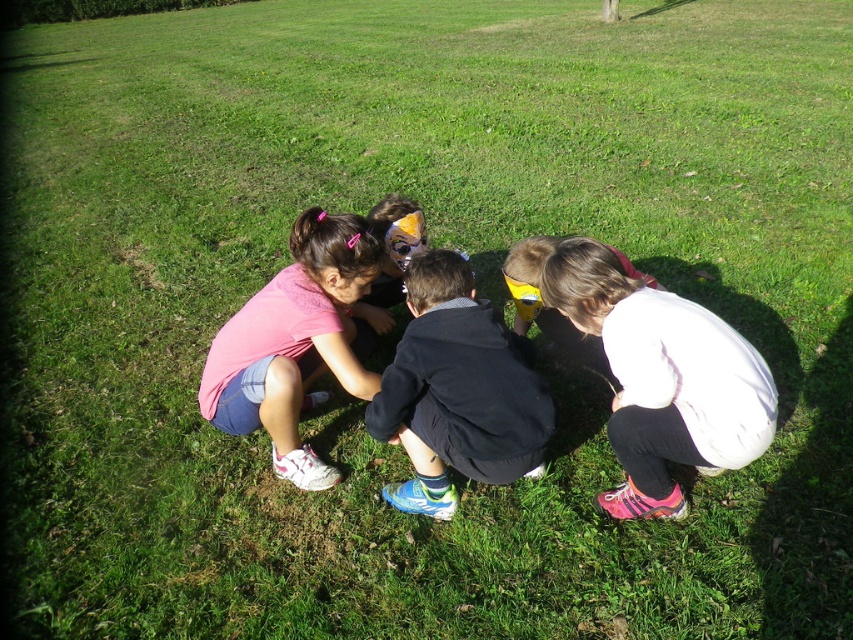
Can you confirm if white matte jacket at lower right is wider than black matte jacket at center?

Yes.

Looking at this image, between white matte jacket at lower right and black matte jacket at center, which one is positioned lower?

Positioned lower is black matte jacket at center.

At what (x,y) coordinates should I click in order to perform the action: click on white matte jacket at lower right. Please return your answer as a coordinate pair (x, y). Image resolution: width=853 pixels, height=640 pixels. Looking at the image, I should click on (662, 378).

Image resolution: width=853 pixels, height=640 pixels. I want to click on white matte jacket at lower right, so click(x=662, y=378).

Which of these two, white matte jacket at lower right or pink fabric shirt at center, stands shorter?

white matte jacket at lower right

Which of these two, white matte jacket at lower right or pink fabric shirt at center, stands taller?

Standing taller between the two is pink fabric shirt at center.

Measure the distance between point (643, 435) and camera.

Point (643, 435) and camera are 2.56 meters apart.

Identify the location of white matte jacket at lower right. (662, 378).

Can you confirm if black matte jacket at center is taller than pink fabric shirt at center?

Incorrect, black matte jacket at center's height is not larger of pink fabric shirt at center's.

Where is `black matte jacket at center`? The image size is (853, 640). black matte jacket at center is located at coordinates (456, 392).

Between point (479, 404) and point (325, 330), which one is positioned behind?

Point (325, 330)

Locate an element on the screen. The image size is (853, 640). black matte jacket at center is located at coordinates point(456,392).